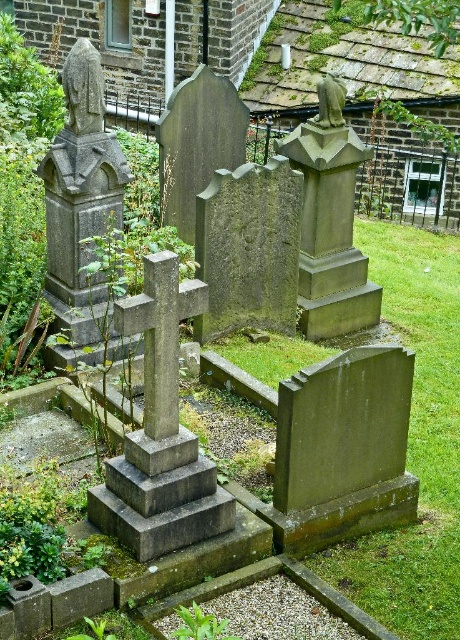
Identify the location of smooth gray stone statue at upper left. (84, 88).

Is smooth gray stone statue at upper left thinner than green stone statue at center?

No.

Which is in front, point (87, 81) or point (329, 84)?

Positioned in front is point (87, 81).

In order to click on smooth gray stone statue at upper left in this screenshot , I will do `click(84, 88)`.